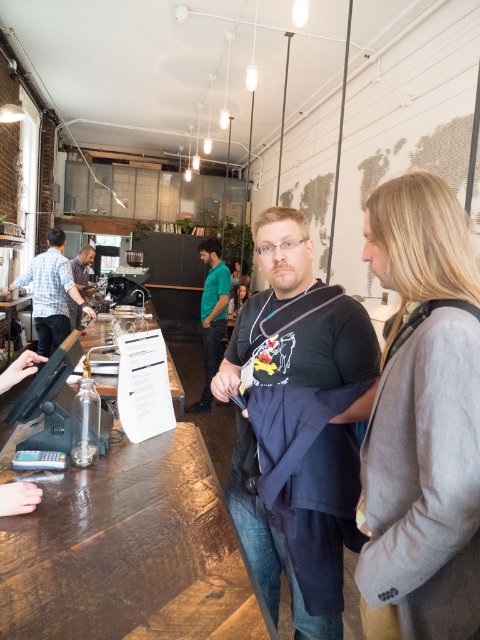
Is plaid shirt at left further to camera compared to green fabric shirt at center?

No.

Is plaid shirt at left wider than green fabric shirt at center?

Yes, plaid shirt at left is wider than green fabric shirt at center.

I want to click on plaid shirt at left, so click(50, 292).

Can you confirm if plaid shirt at left is positioned to the left of matte black shirt at center?

Incorrect, plaid shirt at left is not on the left side of matte black shirt at center.

What do you see at coordinates (50, 292) in the screenshot? The width and height of the screenshot is (480, 640). I see `plaid shirt at left` at bounding box center [50, 292].

Find the location of a particular element. plaid shirt at left is located at coordinates (50, 292).

Measure the distance between black matte t-shirt at center and matte black shirt at center.

black matte t-shirt at center and matte black shirt at center are 4.79 meters apart.

What do you see at coordinates (298, 426) in the screenshot?
I see `black matte t-shirt at center` at bounding box center [298, 426].

The image size is (480, 640). Identify the location of black matte t-shirt at center. coord(298,426).